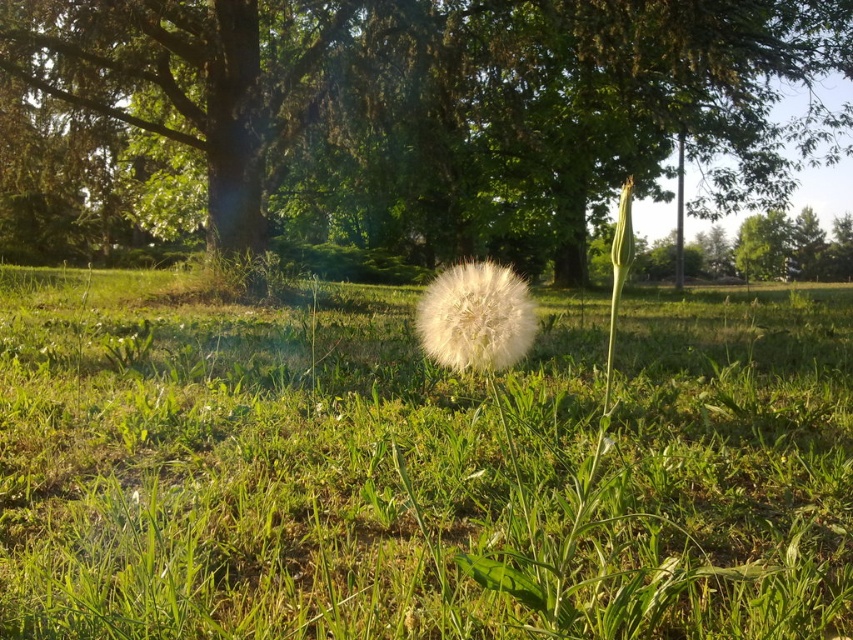
You are standing in the outdoor scene and want to walk from the point closer to you to the point further away. Which path should you take between the two points, point [706,36] and point [479,355]?

You should walk from point [706,36] to point [479,355] because point [706,36] is closer to you and point [479,355] is further away.

You are a photographer standing at the scene. You want to take a closeup photo of the dandelion seed head in the foreground while keeping the green grassy at center in focus. Is it possible to achieve this with a standard camera aperture setting?

The green grassy at center is 4.12 feet away from the camera. With a standard aperture setting, it may be challenging to keep both the dandelion seed head in the foreground and the green grassy at center in focus due to the distance between them.